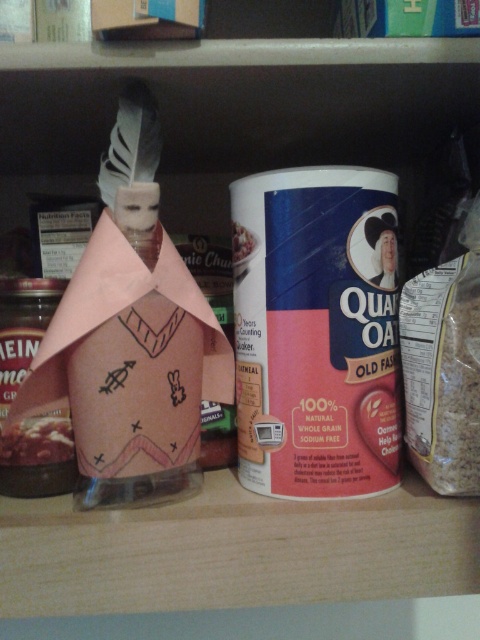
Question: Is the position of matte plastic bottle at center less distant than that of brown matte jar at center?

Choices:
 (A) no
 (B) yes

Answer: (A)

Question: Is matte plastic bottle at center positioned behind smooth white rice at center?

Choices:
 (A) yes
 (B) no

Answer: (A)

Question: Which object is positioned farthest from the matte plastic bottle at center?

Choices:
 (A) brown matte jar at center
 (B) smooth white rice at center

Answer: (B)

Question: Which point is closer to the camera?

Choices:
 (A) (249, 246)
 (B) (25, 301)
 (C) (29, 461)

Answer: (A)

Question: From the image, what is the correct spatial relationship of matte plastic bottle at center in relation to smooth white rice at center?

Choices:
 (A) right
 (B) left

Answer: (B)

Question: Based on their relative distances, which object is farther from the matte plastic bottle at center?

Choices:
 (A) brown matte jar at center
 (B) smooth white rice at center

Answer: (B)